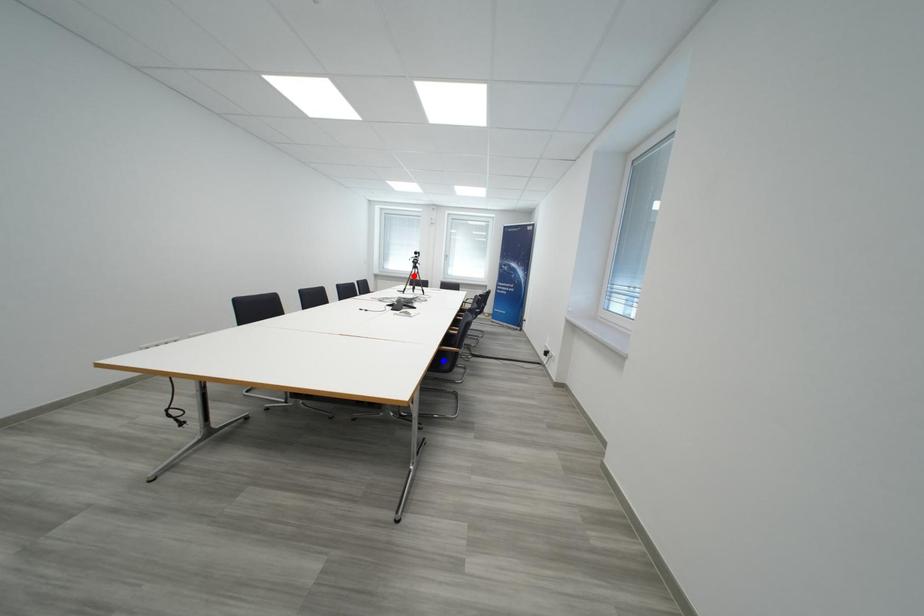
Question: Two points are marked on the image. Which point is closer to the camera?

Choices:
 (A) Blue point is closer.
 (B) Red point is closer.

Answer: (A)